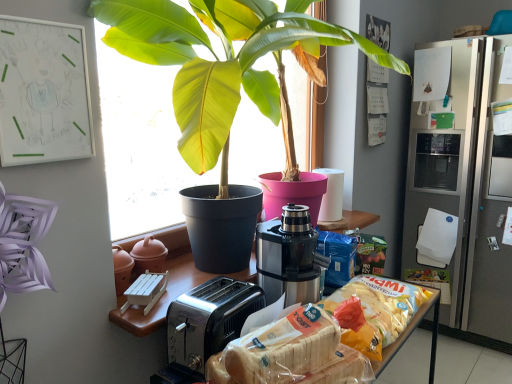
Question: Is satin silver refrigerator at right looking in the opposite direction of translucent plastic bag of chips at center, which is the first snack in back-to-front order?

Choices:
 (A) yes
 (B) no

Answer: (B)

Question: Considering the relative positions of satin silver refrigerator at right and translucent plastic bag of chips at center, which is the first snack in back-to-front order, in the image provided, is satin silver refrigerator at right to the right of translucent plastic bag of chips at center, which is the first snack in back-to-front order, from the viewer's perspective?

Choices:
 (A) no
 (B) yes

Answer: (B)

Question: Considering the relative sizes of satin silver refrigerator at right and translucent plastic bag of chips at center, which is the first snack in back-to-front order, in the image provided, is satin silver refrigerator at right thinner than translucent plastic bag of chips at center, which is the first snack in back-to-front order,?

Choices:
 (A) no
 (B) yes

Answer: (A)

Question: From the image's perspective, does satin silver refrigerator at right appear lower than translucent plastic bag of chips at center, the second snack when ordered from front to back?

Choices:
 (A) yes
 (B) no

Answer: (B)

Question: Is satin silver refrigerator at right shorter than translucent plastic bag of chips at center, which is the first snack in back-to-front order?

Choices:
 (A) yes
 (B) no

Answer: (B)

Question: Would you say satin silver refrigerator at right contains translucent plastic bag of chips at center, the second snack when ordered from front to back?

Choices:
 (A) yes
 (B) no

Answer: (B)

Question: Considering the relative sizes of stainless steel coffee machine at center and satin silver refrigerator at right in the image provided, is stainless steel coffee machine at center bigger than satin silver refrigerator at right?

Choices:
 (A) yes
 (B) no

Answer: (B)

Question: Considering the relative sizes of stainless steel coffee machine at center and satin silver refrigerator at right in the image provided, is stainless steel coffee machine at center taller than satin silver refrigerator at right?

Choices:
 (A) no
 (B) yes

Answer: (A)

Question: Is the depth of stainless steel coffee machine at center greater than that of satin silver refrigerator at right?

Choices:
 (A) no
 (B) yes

Answer: (A)

Question: Can you confirm if stainless steel coffee machine at center is smaller than satin silver refrigerator at right?

Choices:
 (A) yes
 (B) no

Answer: (A)

Question: From a real-world perspective, is stainless steel coffee machine at center on satin silver refrigerator at right?

Choices:
 (A) no
 (B) yes

Answer: (B)

Question: Does stainless steel coffee machine at center touch satin silver refrigerator at right?

Choices:
 (A) no
 (B) yes

Answer: (A)

Question: Considering the relative sizes of white plastic bread at lower center, the 2th snack positioned from the back, and stainless steel coffee machine at center in the image provided, is white plastic bread at lower center, the 2th snack positioned from the back, shorter than stainless steel coffee machine at center?

Choices:
 (A) yes
 (B) no

Answer: (A)